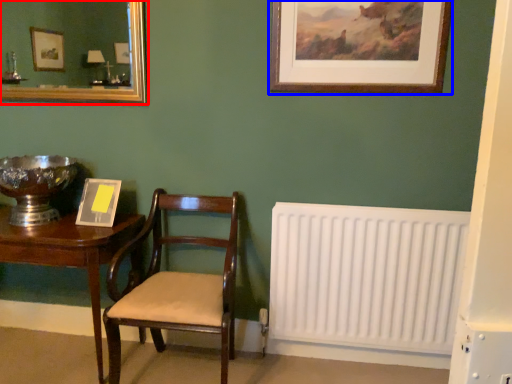
Question: Among these objects, which one is nearest to the camera, mirror (highlighted by a red box) or picture frame (highlighted by a blue box)?

Choices:
 (A) mirror
 (B) picture frame

Answer: (B)